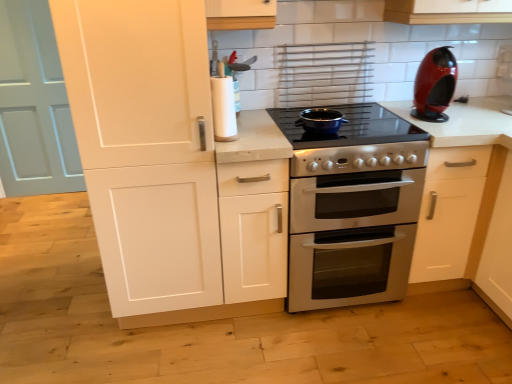
I want to click on free spot in front of smooth white countertop at center, so click(355, 346).